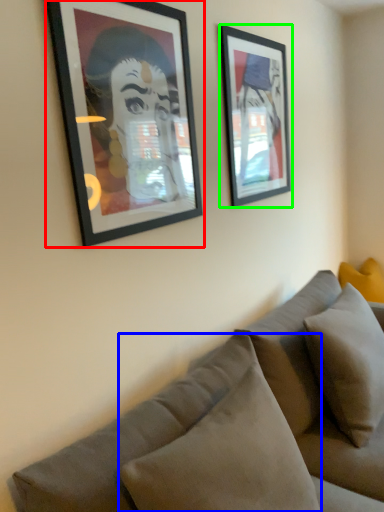
Question: Considering the real-world distances, which object is closest to picture frame (highlighted by a red box)? pillow (highlighted by a blue box) or picture frame (highlighted by a green box).

Choices:
 (A) pillow
 (B) picture frame

Answer: (B)